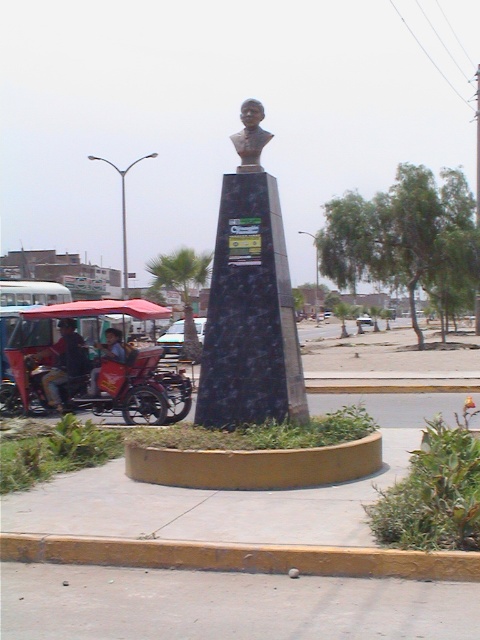
Is bronze bust at center in front of yellow concrete curb at lower center?

→ That is False.

Does bronze bust at center have a greater height compared to yellow concrete curb at lower center?

Indeed, bronze bust at center has a greater height compared to yellow concrete curb at lower center.

Is point (248, 202) closer to camera compared to point (141, 564)?

No, (248, 202) is behind (141, 564).

Find the location of `bronze bust at center`. bronze bust at center is located at coordinates (250, 300).

Which is behind, point (279, 321) or point (252, 160)?

The point (252, 160) is behind.

Is point (241, 236) closer to camera compared to point (257, 148)?

Yes, point (241, 236) is closer to viewer.

You are a GUI agent. You are given a task and a screenshot of the screen. Output one action in this format:
    pyautogui.click(x=<x>, y=<y>)
    Task: Click on the bronze bust at center
    Image resolution: width=480 pixels, height=640 pixels.
    Given the screenshot: What is the action you would take?
    pyautogui.click(x=250, y=300)

How distant is yellow concrete curb at lower center from matte red cart at left?

8.38 meters

Based on the photo, does yellow concrete curb at lower center appear on the right side of matte red cart at left?

Indeed, yellow concrete curb at lower center is positioned on the right side of matte red cart at left.

Is point (265, 563) positioned after point (60, 371)?

That is False.

Locate an element on the screen. The image size is (480, 640). yellow concrete curb at lower center is located at coordinates (240, 556).